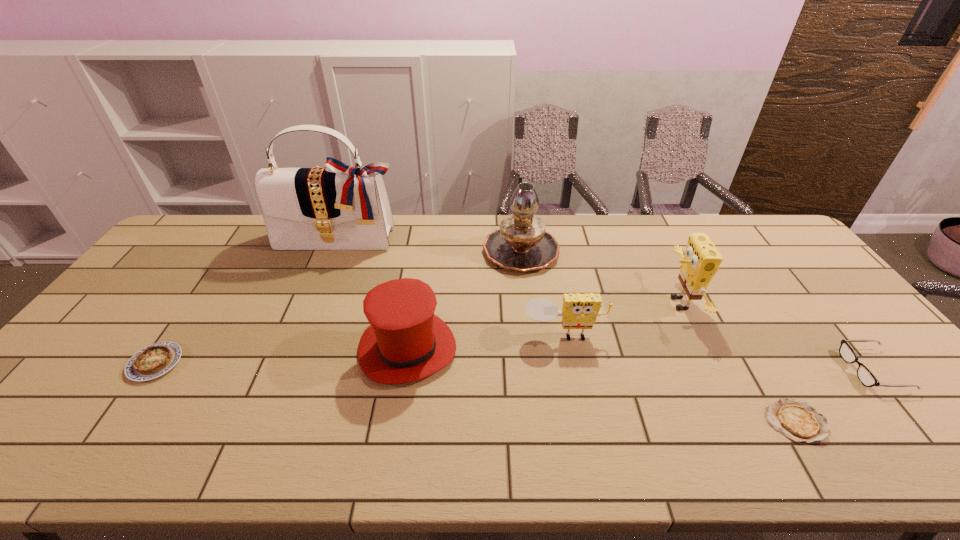
The image size is (960, 540). I want to click on empty space between the satchel and the leftmost object, so click(x=248, y=301).

At what (x,y) coordinates should I click in order to perform the action: click on object identified as the third closest to the taller quiche. Please return your answer as a coordinate pair (x, y). Image resolution: width=960 pixels, height=540 pixels. Looking at the image, I should click on (521, 243).

This screenshot has height=540, width=960. Identify the location of the seventh closest object relative to the hat. (865, 376).

I want to click on vacant space that satisfies the following two spatial constraints: 1. on the front-facing side of the fourth tallest object; 2. on the right side of the tallest object, so click(296, 349).

Where is `vacant space that satisfies the following two spatial constraints: 1. on the front-facing side of the oil lamp; 2. on the right side of the satchel`? The height and width of the screenshot is (540, 960). vacant space that satisfies the following two spatial constraints: 1. on the front-facing side of the oil lamp; 2. on the right side of the satchel is located at coordinates (336, 249).

Identify the location of free space that satisfies the following two spatial constraints: 1. on the face of the right sponge; 2. on the right side of the nearer quiche. (734, 421).

Where is `vacant area in the image that satisfies the following two spatial constraints: 1. on the front-facing side of the nearer quiche; 2. on the left side of the fifth tallest object`? Image resolution: width=960 pixels, height=540 pixels. vacant area in the image that satisfies the following two spatial constraints: 1. on the front-facing side of the nearer quiche; 2. on the left side of the fifth tallest object is located at coordinates (580, 421).